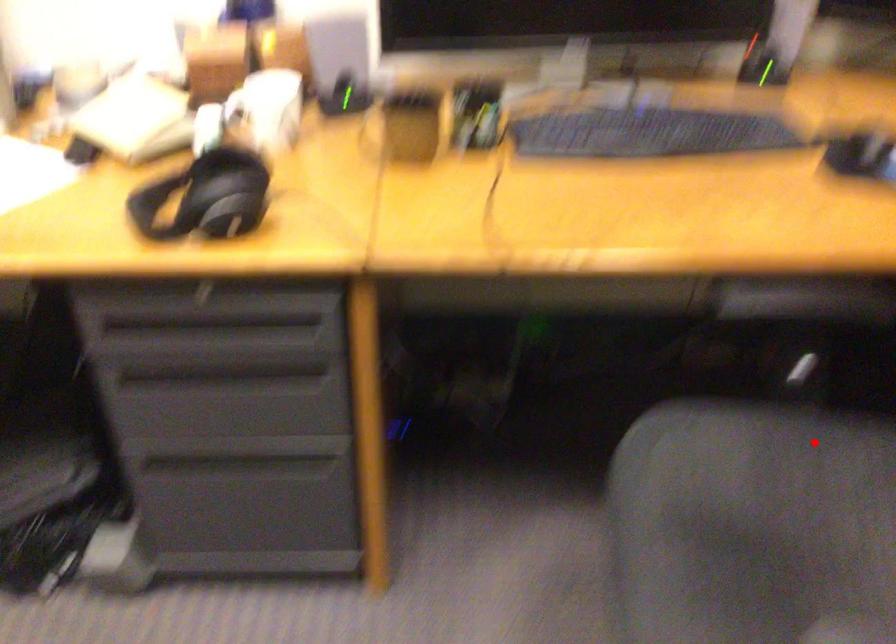
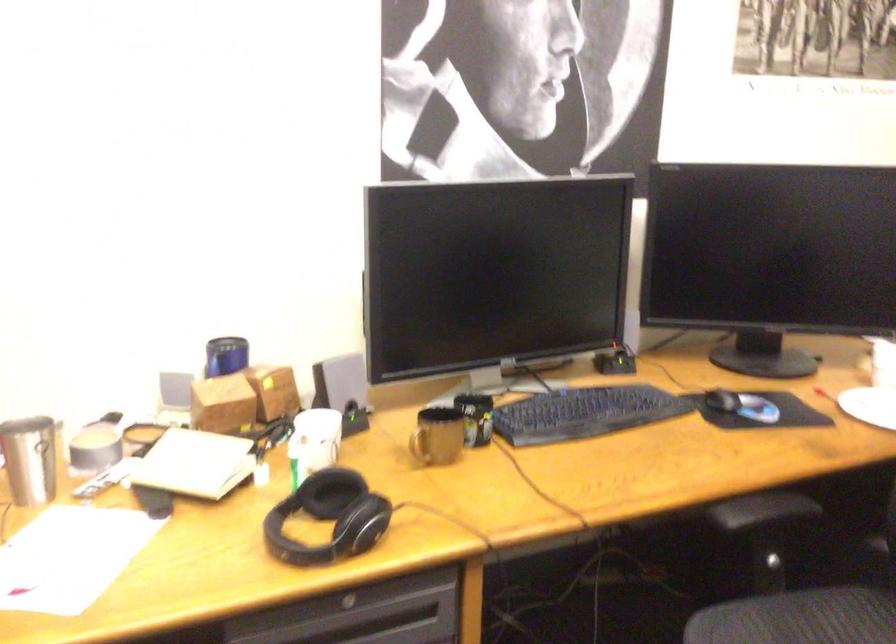
Question: I am providing you with two images of the same scene from different viewpoints. Given a red point in image1, look at the same physical point in image2. Is it:

Choices:
 (A) Closer to the viewpoint
 (B) Farther from the viewpoint

Answer: (B)